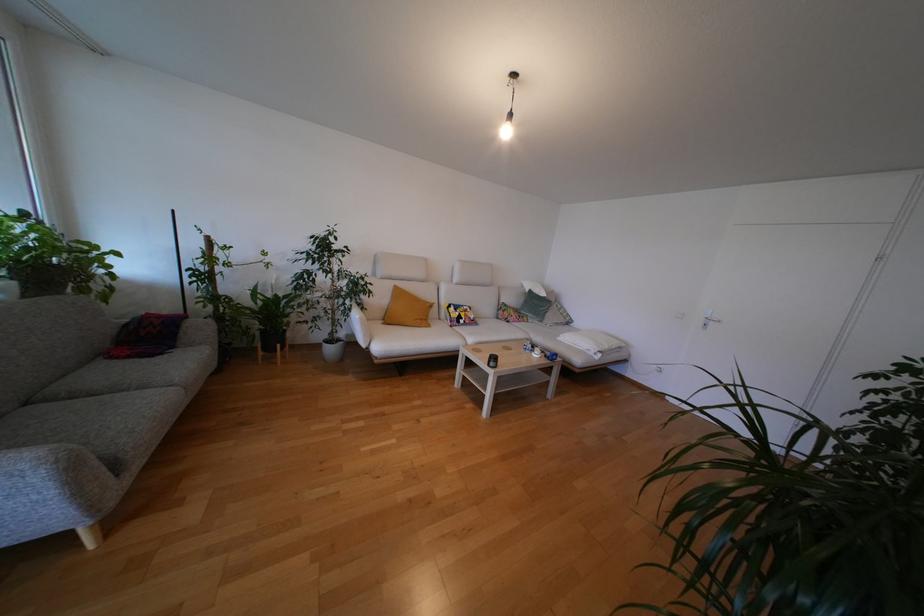
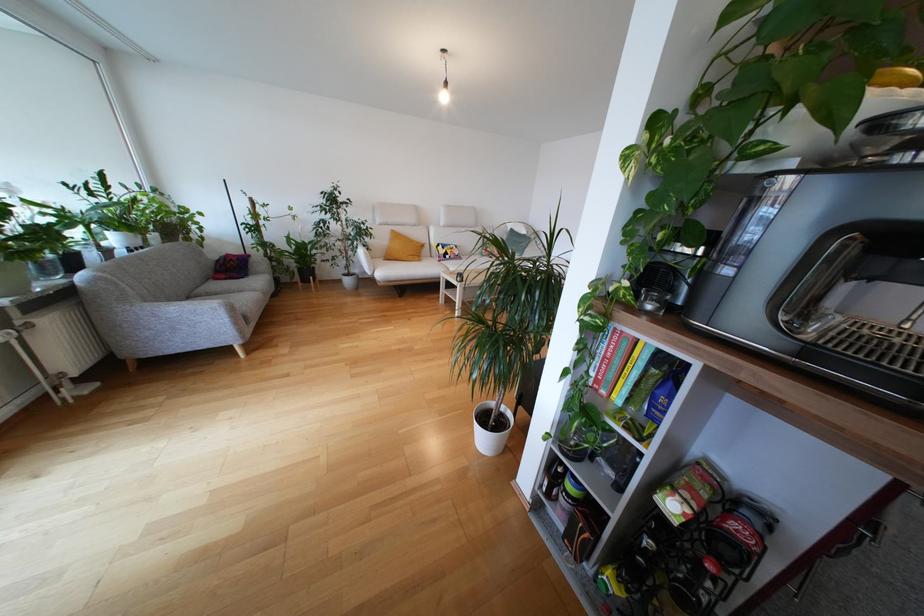
In the second image, find the point that corresponds to point 511,135 in the first image.

(448, 100)